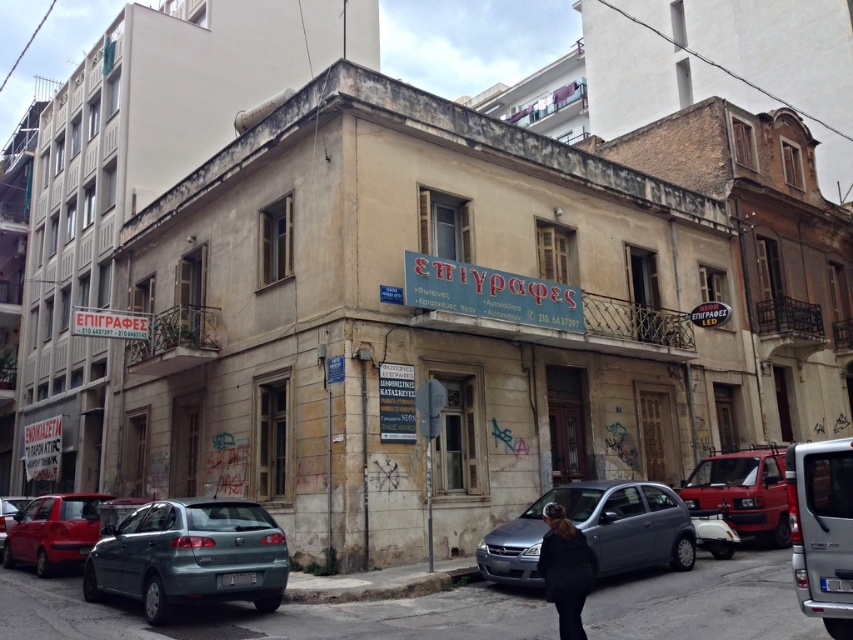
You are standing at the corner of the city street looking at the building with the large signboard. There are two points marked on the building facade at coordinates point (769, 486) and point (549, 522). Which of these points is closer to you?

Point (549, 522) is closer to you because it is not as far as point (769, 486) which is further away from the camera.

Consider the image. You are a delivery driver approaching the building with a matte red van at center. The parking space you need to enter is 15 meters long. Can your van fit into the space?

The matte red van at center is 13.46 meters from camera, so yes, the van can fit into the 15 meter parking space since it is shorter than the available length.

Consider the image. You are a delivery driver who needs to park your silver metallic van at lower right near the building. The parking spot is marked by a point at coordinate [822,529]. Can you confirm if the van is already parked correctly at that spot?

The point at coordinate [822,529] indicates the silver metallic van at lower right is already parked correctly at that spot.